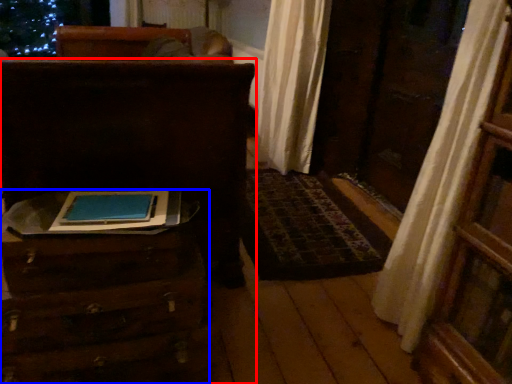
Question: Which object appears closest to the camera in this image, furniture (highlighted by a red box) or furniture (highlighted by a blue box)?

Choices:
 (A) furniture
 (B) furniture

Answer: (B)